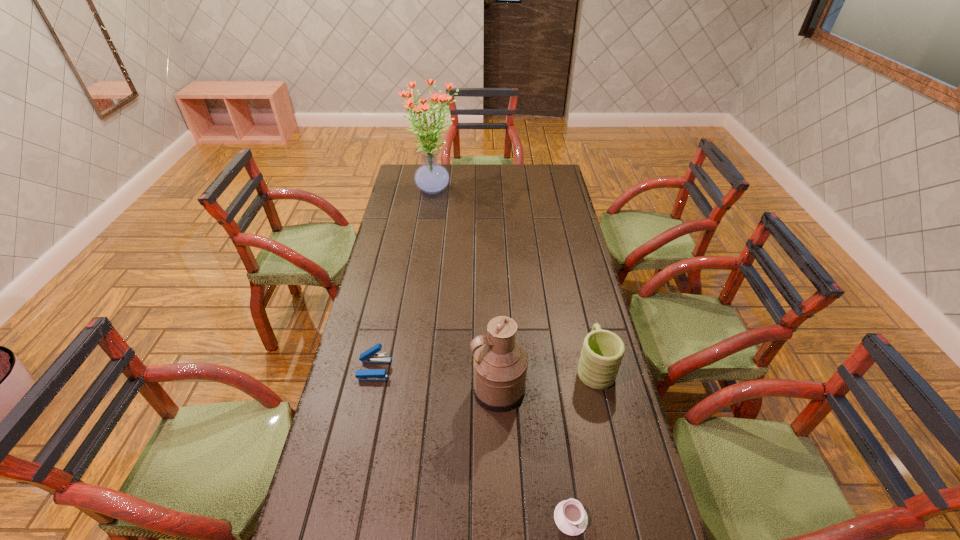
Where is `vacant space located on the back of the third object from right to left`? Image resolution: width=960 pixels, height=540 pixels. vacant space located on the back of the third object from right to left is located at coordinates (496, 349).

In order to click on free region located 0.110m on the side of the third tallest object with the handle in this screenshot , I will do `click(584, 321)`.

The width and height of the screenshot is (960, 540). Identify the location of vacant region located on the side of the third tallest object with the handle. (573, 275).

The height and width of the screenshot is (540, 960). Identify the location of vacant space located 0.400m on the side of the third tallest object with the handle. (571, 266).

Where is `vacant region located 0.080m on the front of the fourth tallest object`? The image size is (960, 540). vacant region located 0.080m on the front of the fourth tallest object is located at coordinates (367, 404).

Locate an element on the screen. This screenshot has width=960, height=540. vacant space located 0.270m on the handle side of the teacup is located at coordinates (555, 404).

This screenshot has height=540, width=960. I want to click on blank space located 0.130m on the handle side of the teacup, so click(x=561, y=450).

The height and width of the screenshot is (540, 960). Find the location of `free spot located 0.190m on the handle side of the teacup`. free spot located 0.190m on the handle side of the teacup is located at coordinates (558, 429).

At what (x,y) coordinates should I click in order to perform the action: click on object situated at the far edge. Please return your answer as a coordinate pair (x, y). This screenshot has height=540, width=960. Looking at the image, I should click on (431, 177).

In order to click on flower arrangement situated at the left edge in this screenshot , I will do `click(431, 177)`.